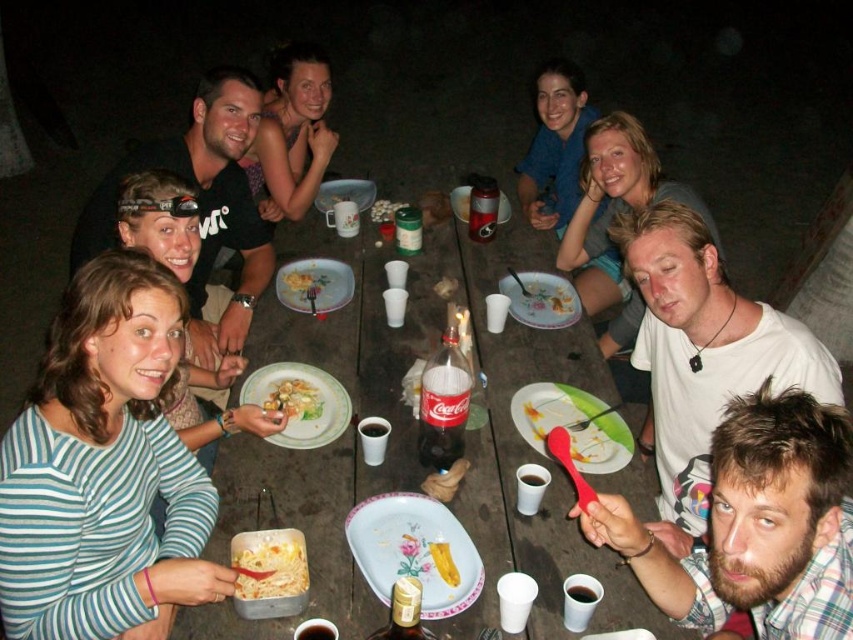
Which is above, matte blue shirt at upper center or yellow pasta at center?

matte blue shirt at upper center is higher up.

Which is behind, point (573, 120) or point (300, 570)?

Positioned behind is point (573, 120).

Describe the element at coordinates (554, 145) in the screenshot. I see `matte blue shirt at upper center` at that location.

You are a GUI agent. You are given a task and a screenshot of the screen. Output one action in this format:
    pyautogui.click(x=<x>, y=<y>)
    Task: Click on the matte blue shirt at upper center
    Image resolution: width=853 pixels, height=640 pixels.
    Given the screenshot: What is the action you would take?
    pyautogui.click(x=554, y=145)

Between blue striped shirt at lower left and matte blue shirt at upper center, which one appears on the right side from the viewer's perspective?

Positioned to the right is matte blue shirt at upper center.

Which is in front, point (175, 524) or point (558, 148)?

Point (175, 524) is in front.

Is point (160, 396) closer to camera compared to point (572, 72)?

That is True.

Find the location of `blue striped shirt at lower left`. blue striped shirt at lower left is located at coordinates point(105,468).

Can you confirm if wooden table at center is bigger than matte blue shirt at upper center?

Indeed, wooden table at center has a larger size compared to matte blue shirt at upper center.

Does wooden table at center appear over matte blue shirt at upper center?

No, wooden table at center is not above matte blue shirt at upper center.

Locate an element on the screen. wooden table at center is located at coordinates (416, 442).